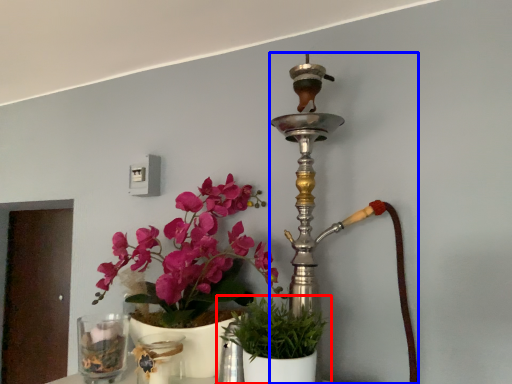
Question: Which object is further to the camera taking this photo, houseplant (highlighted by a red box) or candle holder (highlighted by a blue box)?

Choices:
 (A) houseplant
 (B) candle holder

Answer: (B)